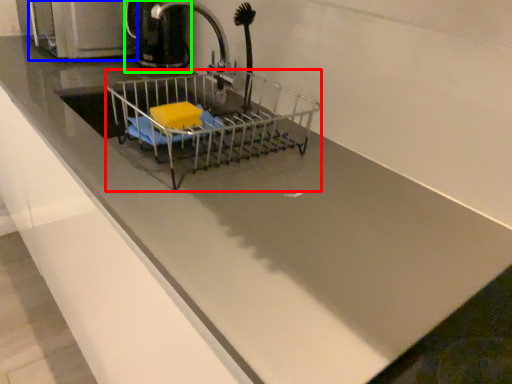
Question: Which is nearer to the shopping cart (highlighted by a red box)? appliance (highlighted by a blue box) or coffeepot (highlighted by a green box).

Choices:
 (A) appliance
 (B) coffeepot

Answer: (B)